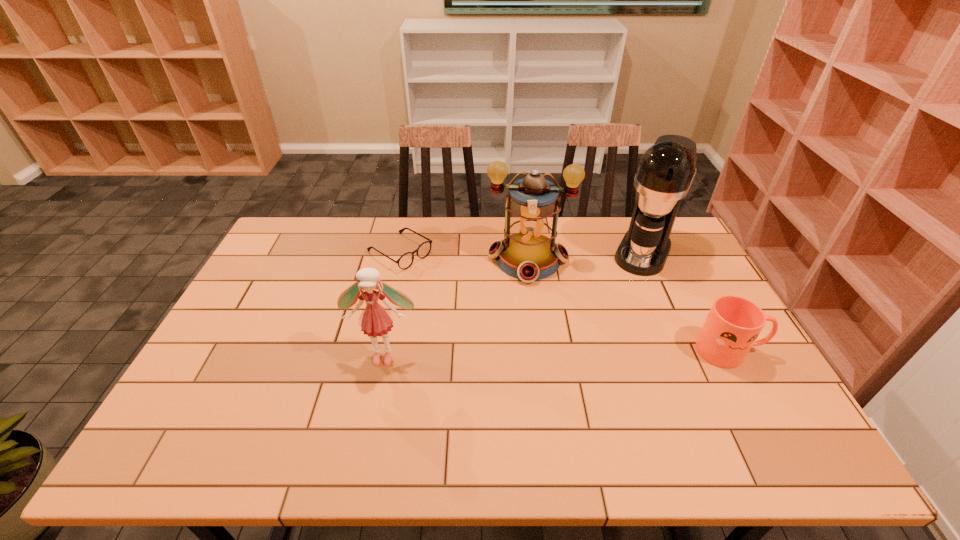
Identify the location of the third shortest object. (375, 320).

The image size is (960, 540). Identify the location of mug. (733, 324).

Locate an element on the screen. The image size is (960, 540). the fourth shortest object is located at coordinates pos(528,252).

What are the coordinates of `the third object from right to left` in the screenshot? It's located at (528, 252).

I want to click on spectacles, so pyautogui.click(x=405, y=261).

You are a GUI agent. You are given a task and a screenshot of the screen. Output one action in this format:
    pyautogui.click(x=<x>, y=<y>)
    Task: Click on the coffee maker
    
    Given the screenshot: What is the action you would take?
    pyautogui.click(x=665, y=172)

This screenshot has height=540, width=960. Find the location of `vacant space located on the front-facing side of the doll`. vacant space located on the front-facing side of the doll is located at coordinates (373, 406).

Where is `vacant space located 0.080m on the front-facing side of the lantern`? The height and width of the screenshot is (540, 960). vacant space located 0.080m on the front-facing side of the lantern is located at coordinates (526, 304).

Identify the location of vacant space located on the front-facing side of the lantern. The width and height of the screenshot is (960, 540). (525, 316).

This screenshot has height=540, width=960. I want to click on vacant point located 0.280m on the front-facing side of the lantern, so click(x=524, y=356).